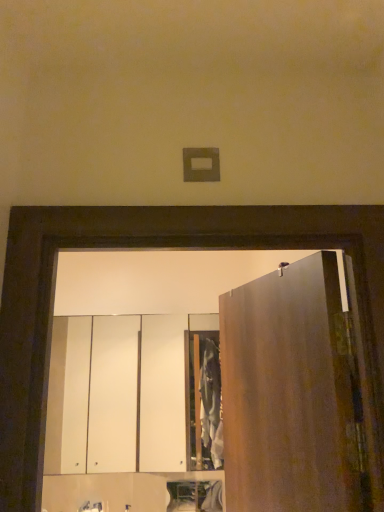
Measure the distance between point (282, 340) and camera.

Point (282, 340) is 1.20 meters from camera.

What is the approximate width of white glossy cabinet at lower center, the 1th cabinetry positioned from the bottom?

It is 1.79 inches.

Locate an element on the screen. Image resolution: width=384 pixels, height=512 pixels. matte silver faucet at lower center is located at coordinates (91, 507).

Between matte brown door at right and white glossy cabinet at center, positioned as the 2th cabinetry in bottom-to-top order, which one has smaller size?

white glossy cabinet at center, positioned as the 2th cabinetry in bottom-to-top order.

Would you say matte brown door at right is a long distance from white glossy cabinet at center, arranged as the 1th cabinetry when viewed from the top?

Yes, matte brown door at right and white glossy cabinet at center, arranged as the 1th cabinetry when viewed from the top, are quite far apart.

Does matte brown door at right have a lesser height compared to white glossy cabinet at center, arranged as the 1th cabinetry when viewed from the top?

Yes.

Looking at this image, from a real-world perspective, is matte brown door at right physically below white glossy cabinet at center, arranged as the 1th cabinetry when viewed from the top?

Incorrect, from a real-world perspective, matte brown door at right is higher than white glossy cabinet at center, arranged as the 1th cabinetry when viewed from the top.

Considering the relative sizes of matte brown door at right and matte silver faucet at lower center in the image provided, is matte brown door at right smaller than matte silver faucet at lower center?

Incorrect, matte brown door at right is not smaller in size than matte silver faucet at lower center.

From the image's perspective, would you say matte brown door at right is shown under matte silver faucet at lower center?

No, from the image's perspective, matte brown door at right is not beneath matte silver faucet at lower center.

Looking at this image, can we say matte brown door at right lies outside matte silver faucet at lower center?

Yes.

Is matte brown door at right with matte silver faucet at lower center?

They are not placed beside each other.

How far apart are white glossy cabinet at lower center, the 1th cabinetry positioned from the bottom, and matte brown door at right?

They are 4.88 feet apart.

Can you see white glossy cabinet at lower center, the 2th cabinetry positioned from the top, touching matte brown door at right?

They are not placed beside each other.

Which object is further away from the camera, white glossy cabinet at lower center, the 2th cabinetry positioned from the top, or matte brown door at right?

white glossy cabinet at lower center, the 2th cabinetry positioned from the top, is further away from the camera.

Is matte silver faucet at lower center wider or thinner than matte brown door at right?

Considering their sizes, matte silver faucet at lower center looks broader than matte brown door at right.

Is point (92, 503) positioned behind point (305, 273)?

Yes, point (92, 503) is farther from viewer.

Which object is closer to the camera, matte silver faucet at lower center or matte brown door at right?

matte brown door at right is more forward.

Considering the sizes of objects matte silver faucet at lower center and white glossy cabinet at center, positioned as the 2th cabinetry in bottom-to-top order, in the image provided, who is thinner, matte silver faucet at lower center or white glossy cabinet at center, positioned as the 2th cabinetry in bottom-to-top order,?

white glossy cabinet at center, positioned as the 2th cabinetry in bottom-to-top order, is thinner.

What's the angular difference between matte silver faucet at lower center and white glossy cabinet at center, arranged as the 1th cabinetry when viewed from the top,'s facing directions?

The facing directions of matte silver faucet at lower center and white glossy cabinet at center, arranged as the 1th cabinetry when viewed from the top, are 1.91 degrees apart.

Would you say matte silver faucet at lower center is inside or outside white glossy cabinet at center, positioned as the 2th cabinetry in bottom-to-top order?

matte silver faucet at lower center lies outside white glossy cabinet at center, positioned as the 2th cabinetry in bottom-to-top order.

Is point (98, 508) closer to viewer compared to point (62, 383)?

Yes, it is.

Does white glossy cabinet at lower center, the 2th cabinetry positioned from the top, have a greater width compared to matte silver faucet at lower center?

No, white glossy cabinet at lower center, the 2th cabinetry positioned from the top, is not wider than matte silver faucet at lower center.

Is white glossy cabinet at lower center, the 2th cabinetry positioned from the top, not within matte silver faucet at lower center?

Yes, white glossy cabinet at lower center, the 2th cabinetry positioned from the top, is outside of matte silver faucet at lower center.

From the picture: Who is bigger, white glossy cabinet at lower center, the 2th cabinetry positioned from the top, or matte silver faucet at lower center?

With larger size is white glossy cabinet at lower center, the 2th cabinetry positioned from the top.

From a real-world perspective, is white glossy cabinet at lower center, the 2th cabinetry positioned from the top, physically located above or below matte silver faucet at lower center?

white glossy cabinet at lower center, the 2th cabinetry positioned from the top, is situated higher than matte silver faucet at lower center in the real world.

Is white glossy cabinet at center, positioned as the 2th cabinetry in bottom-to-top order, facing towards matte silver faucet at lower center?

No, white glossy cabinet at center, positioned as the 2th cabinetry in bottom-to-top order, is not aimed at matte silver faucet at lower center.

Is white glossy cabinet at center, positioned as the 2th cabinetry in bottom-to-top order, shorter than matte silver faucet at lower center?

Incorrect, the height of white glossy cabinet at center, positioned as the 2th cabinetry in bottom-to-top order, does not fall short of that of matte silver faucet at lower center.

From the image's perspective, is white glossy cabinet at center, positioned as the 2th cabinetry in bottom-to-top order, located above or below matte silver faucet at lower center?

From the image's perspective, white glossy cabinet at center, positioned as the 2th cabinetry in bottom-to-top order, appears above matte silver faucet at lower center.

From a real-world perspective, starting from the matte silver faucet at lower center, which cabinetry is the 2nd one vertically above it? Please provide its 2D coordinates.

[(133, 396)]

Where is `door above the white glossy cabinet at center, positioned as the 2th cabinetry in bottom-to-top order (from the image's perspective)`? door above the white glossy cabinet at center, positioned as the 2th cabinetry in bottom-to-top order (from the image's perspective) is located at coordinates (289, 393).

The height and width of the screenshot is (512, 384). I want to click on faucet that is behind the matte brown door at right, so click(x=91, y=507).

Looking at the image, which one is located further to white glossy cabinet at lower center, the 2th cabinetry positioned from the top, white glossy cabinet at center, positioned as the 2th cabinetry in bottom-to-top order, or matte brown door at right?

Among the two, white glossy cabinet at center, positioned as the 2th cabinetry in bottom-to-top order, is located further to white glossy cabinet at lower center, the 2th cabinetry positioned from the top.

Consider the image. Estimate the real-world distances between objects in this image. Which object is closer to matte silver faucet at lower center, white glossy cabinet at center, arranged as the 1th cabinetry when viewed from the top, or white glossy cabinet at lower center, the 2th cabinetry positioned from the top?

The object closer to matte silver faucet at lower center is white glossy cabinet at lower center, the 2th cabinetry positioned from the top.

When comparing their distances from matte brown door at right, does white glossy cabinet at center, arranged as the 1th cabinetry when viewed from the top, or white glossy cabinet at lower center, the 1th cabinetry positioned from the bottom, seem further?

Based on the image, white glossy cabinet at center, arranged as the 1th cabinetry when viewed from the top, appears to be further to matte brown door at right.

Based on their spatial positions, is matte silver faucet at lower center or matte brown door at right closer to white glossy cabinet at center, positioned as the 2th cabinetry in bottom-to-top order?

matte silver faucet at lower center is closer to white glossy cabinet at center, positioned as the 2th cabinetry in bottom-to-top order.

Looking at the image, which one is located closer to matte silver faucet at lower center, matte brown door at right or white glossy cabinet at lower center, the 2th cabinetry positioned from the top?

Based on the image, white glossy cabinet at lower center, the 2th cabinetry positioned from the top, appears to be nearer to matte silver faucet at lower center.

Looking at the image, which one is located closer to white glossy cabinet at lower center, the 2th cabinetry positioned from the top, matte silver faucet at lower center or matte brown door at right?

matte silver faucet at lower center lies closer to white glossy cabinet at lower center, the 2th cabinetry positioned from the top, than the other object.

Based on their spatial positions, is white glossy cabinet at lower center, the 2th cabinetry positioned from the top, or matte silver faucet at lower center closer to matte brown door at right?

white glossy cabinet at lower center, the 2th cabinetry positioned from the top, is closer to matte brown door at right.

Based on the photo, considering their positions, is matte brown door at right positioned further to white glossy cabinet at center, positioned as the 2th cabinetry in bottom-to-top order, than white glossy cabinet at lower center, the 2th cabinetry positioned from the top?

Among the two, matte brown door at right is located further to white glossy cabinet at center, positioned as the 2th cabinetry in bottom-to-top order.

The width and height of the screenshot is (384, 512). Find the location of `faucet located between matte brown door at right and white glossy cabinet at center, arranged as the 1th cabinetry when viewed from the top, in the depth direction`. faucet located between matte brown door at right and white glossy cabinet at center, arranged as the 1th cabinetry when viewed from the top, in the depth direction is located at coordinates (91, 507).

Identify the location of cabinetry between matte brown door at right and white glossy cabinet at center, positioned as the 2th cabinetry in bottom-to-top order, in the front-back direction. (105, 492).

Locate an element on the screen. The image size is (384, 512). cabinetry between white glossy cabinet at center, positioned as the 2th cabinetry in bottom-to-top order, and matte silver faucet at lower center from top to bottom is located at coordinates pyautogui.click(x=105, y=492).

Where is `faucet located between matte brown door at right and white glossy cabinet at lower center, the 2th cabinetry positioned from the top, in the depth direction`? faucet located between matte brown door at right and white glossy cabinet at lower center, the 2th cabinetry positioned from the top, in the depth direction is located at coordinates point(91,507).